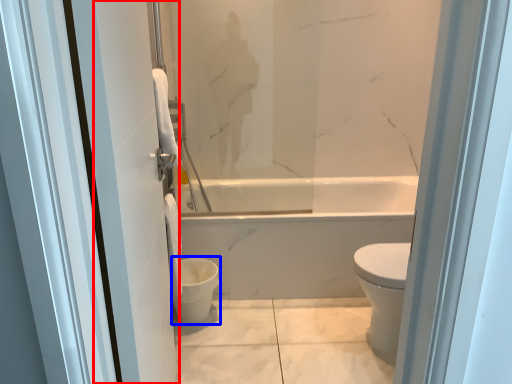
Question: Which object appears farthest to the camera in this image, screen door (highlighted by a red box) or toilet bowl (highlighted by a blue box)?

Choices:
 (A) screen door
 (B) toilet bowl

Answer: (B)